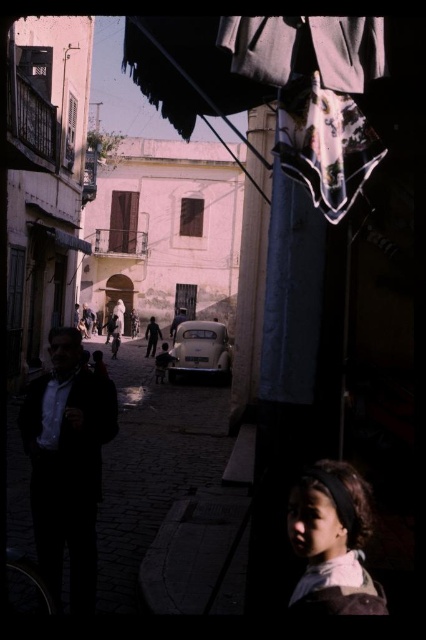
You are standing on the street looking at the historical buildings. There are two points marked on the ground in front of you. The first point is at coordinates point (48, 564) and the second point is at point (167, 362). Which point is closer to you?

Point (48, 564) is closer to the viewer than point (167, 362).

You are a photographer standing in the street scene. You notice a dark matte suit at left and a dark brown hair at center. Which object is closer to you?

The dark matte suit at left is closer to you because it is in front of the dark brown hair at center.